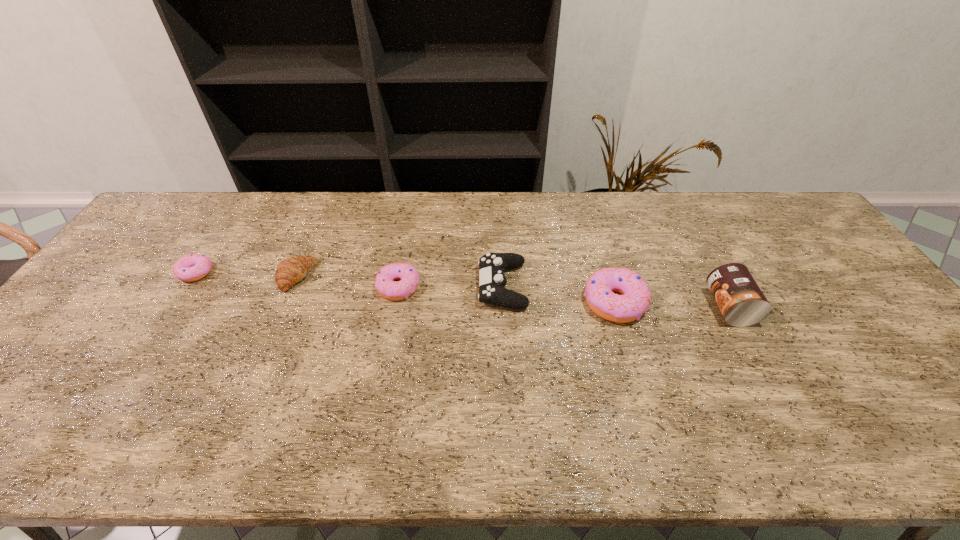
Find the location of a particular element. The width and height of the screenshot is (960, 540). free space located 0.190m on the left of the shortest doughnut is located at coordinates (114, 273).

In order to click on blank space located on the right of the fourth object from right to left in this screenshot , I will do click(533, 287).

Find the location of `vacant area situated on the right of the rightmost doughnut`. vacant area situated on the right of the rightmost doughnut is located at coordinates (784, 302).

Identify the location of vacant space situated on the surface of the fourth object from left to right. click(x=453, y=286).

This screenshot has width=960, height=540. What are the coordinates of `vacant region located on the surface of the fourth object from left to right` in the screenshot? It's located at tap(345, 286).

What are the coordinates of `blank space located 0.240m on the surface of the fourth object from left to right` in the screenshot? It's located at (394, 286).

Locate an element on the screen. This screenshot has width=960, height=540. blank space located 0.260m on the front label of the rightmost object is located at coordinates (613, 307).

Image resolution: width=960 pixels, height=540 pixels. In order to click on free spot located on the front label of the rightmost object in this screenshot , I will do `click(661, 307)`.

Find the location of a particular element. The height and width of the screenshot is (540, 960). free location located 0.400m on the front label of the rightmost object is located at coordinates (563, 307).

Locate an element on the screen. This screenshot has width=960, height=540. free space located on the left of the second object from left to right is located at coordinates (248, 276).